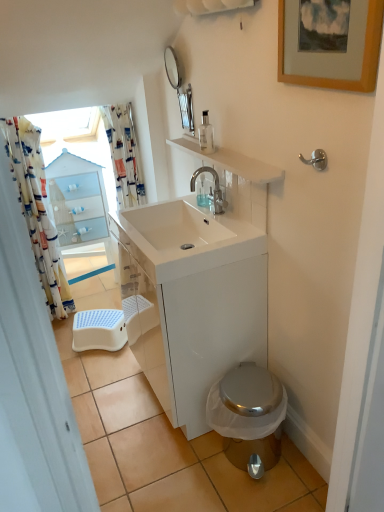
This screenshot has width=384, height=512. Identify the location of vacant space in front of shiny metallic toilet at lower right. (268, 490).